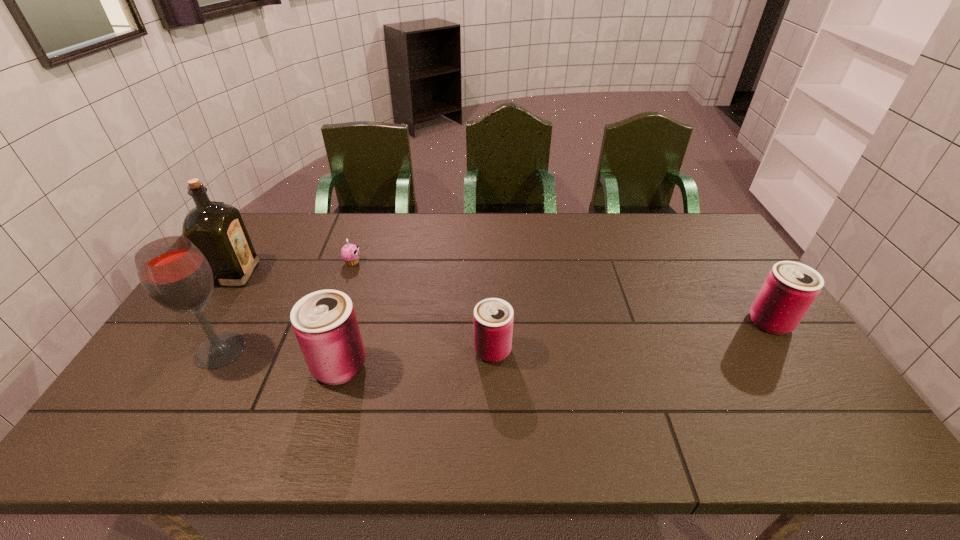
To achieve even spacing by inserting another can among them, please point to a vacant spot for this new can. Please provide its 2D coordinates. Your answer should be formatted as a tuple, i.e. [(x, y)], where the tuple contains the x and y coordinates of a point satisfying the conditions above.

[(636, 336)]